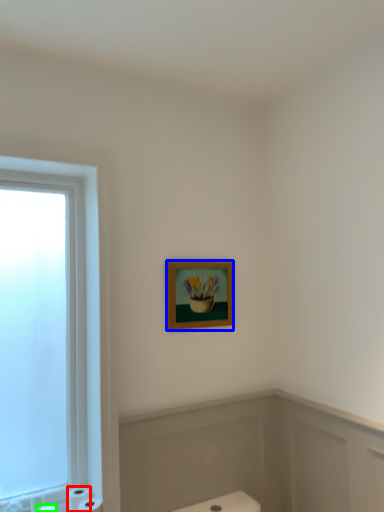
Question: Considering the real-world distances, which object is closest to toilet paper (highlighted by a red box)? picture frame (highlighted by a blue box) or toilet paper (highlighted by a green box).

Choices:
 (A) picture frame
 (B) toilet paper

Answer: (B)